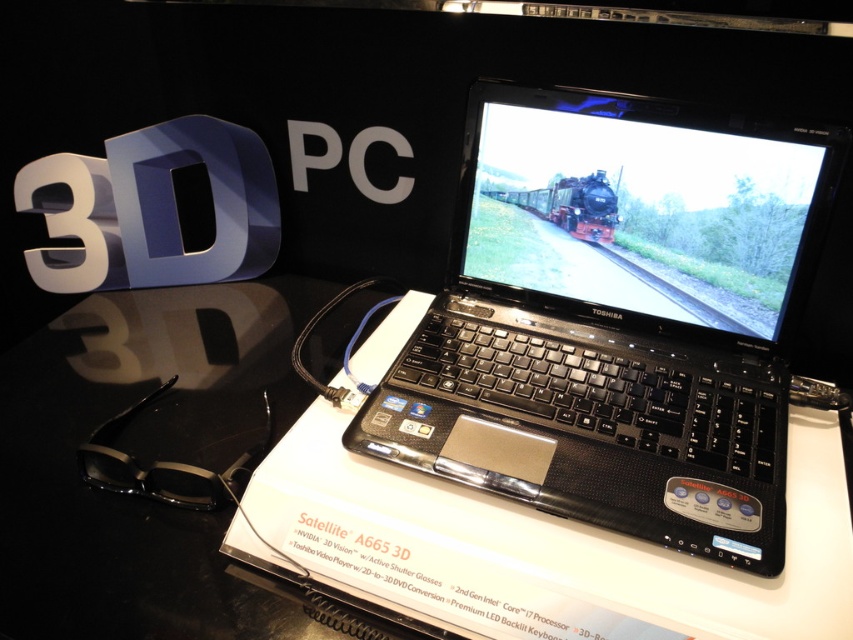
Question: Is matte black train at center bigger than gray asphalt train track at center?

Choices:
 (A) no
 (B) yes

Answer: (B)

Question: Which point is closer to the camera?

Choices:
 (A) black glossy table at center
 (B) black plastic laptop at center

Answer: (A)

Question: Is black glossy table at center wider than gray asphalt train track at center?

Choices:
 (A) yes
 (B) no

Answer: (A)

Question: Which point is closer to the camera?

Choices:
 (A) matte black train at center
 (B) gray asphalt train track at center
 (C) black plastic laptop at center
 (D) black glossy table at center

Answer: (D)

Question: Estimate the real-world distances between objects in this image. Which object is closer to the matte black train at center?

Choices:
 (A) black plastic laptop at center
 (B) black glossy table at center

Answer: (A)

Question: Is black plastic laptop at center closer to the viewer compared to gray asphalt train track at center?

Choices:
 (A) no
 (B) yes

Answer: (B)